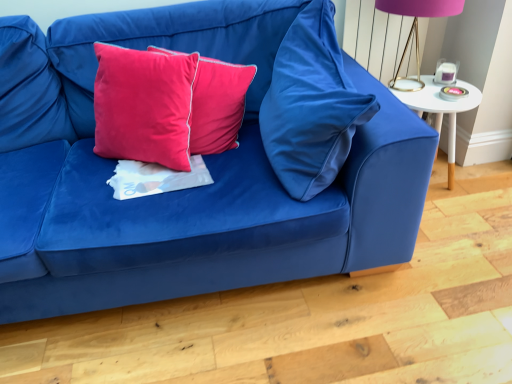
Locate an element on the screen. free spot above white glossy side table at right (from a real-world perspective) is located at coordinates (437, 94).